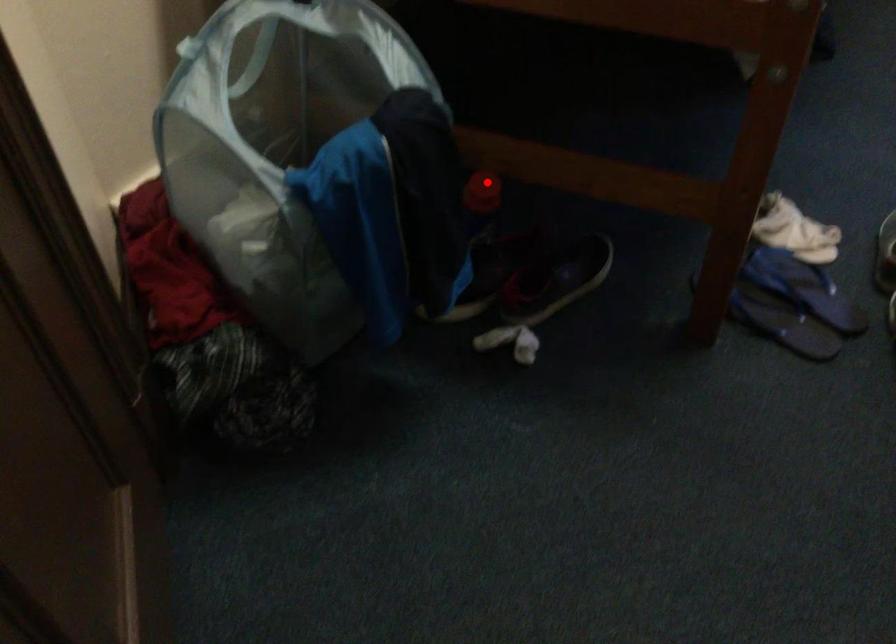
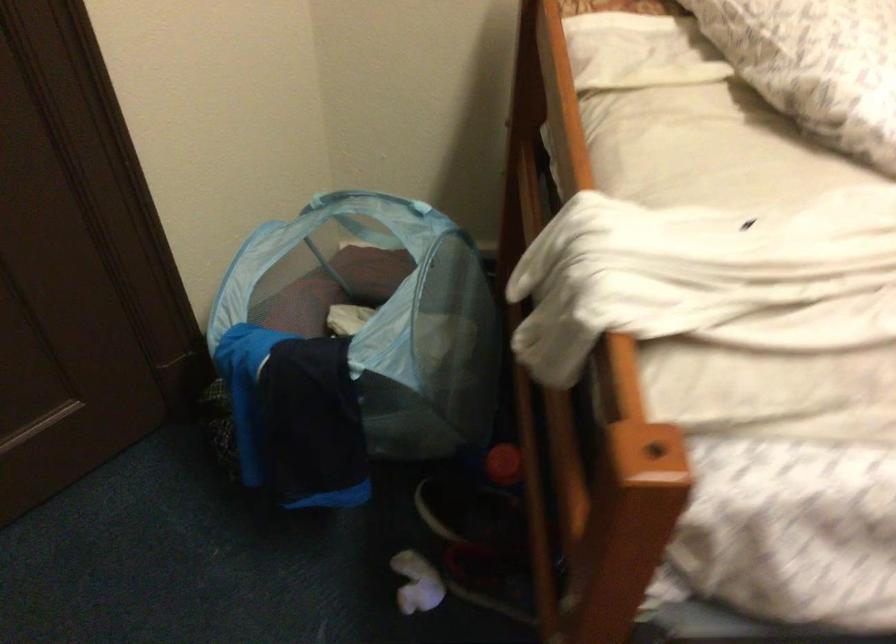
Question: I am providing you with two images of the same scene from different viewpoints. A red point is marked on the first image. Is the red point's position out of view in image 2?

Choices:
 (A) Yes
 (B) No

Answer: (B)